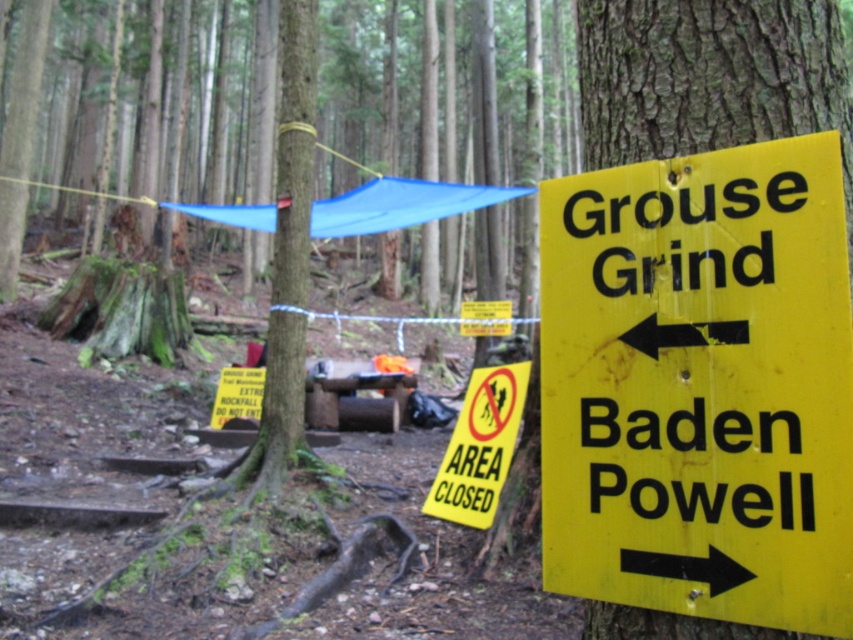
Can you confirm if yellow matte sign at right is wider than yellow paper sign at center?

In fact, yellow matte sign at right might be narrower than yellow paper sign at center.

Describe the element at coordinates (700, 385) in the screenshot. I see `yellow matte sign at right` at that location.

Where is `yellow matte sign at right`? Image resolution: width=853 pixels, height=640 pixels. yellow matte sign at right is located at coordinates (700, 385).

You are a GUI agent. You are given a task and a screenshot of the screen. Output one action in this format:
    pyautogui.click(x=<x>, y=<y>)
    Task: Click on the yellow matte sign at right
    
    Given the screenshot: What is the action you would take?
    pyautogui.click(x=700, y=385)